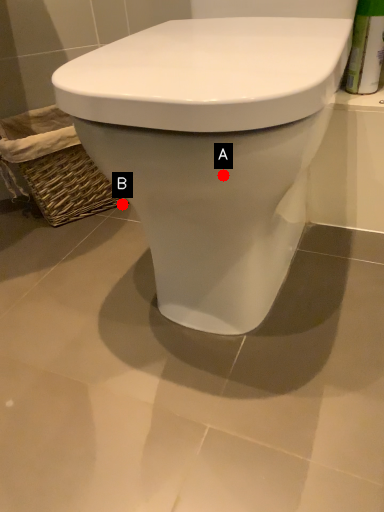
Question: Two points are circled on the image, labeled by A and B beside each circle. Which point is closer to the camera?

Choices:
 (A) A is closer
 (B) B is closer

Answer: (A)